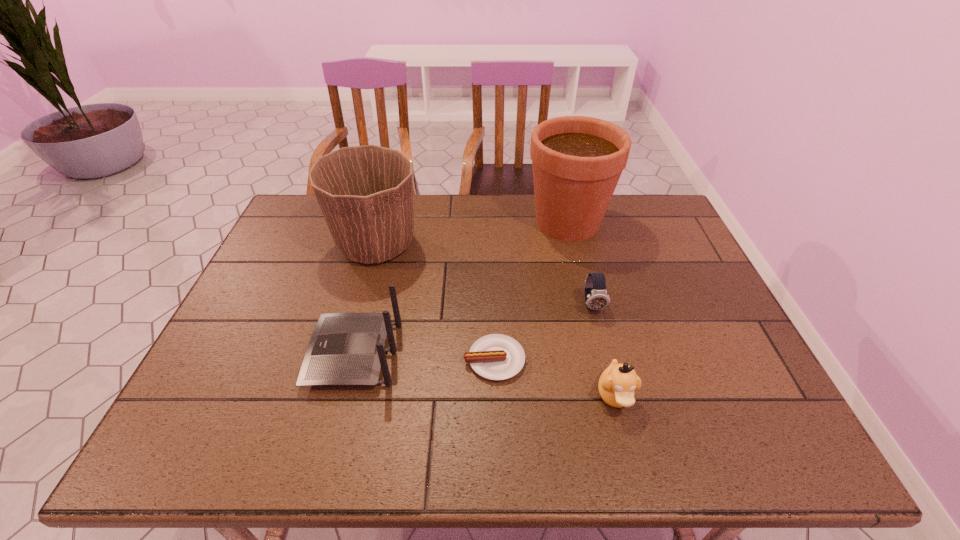
The width and height of the screenshot is (960, 540). In order to click on the right flowerpot in this screenshot , I will do `click(577, 161)`.

The height and width of the screenshot is (540, 960). I want to click on the left flowerpot, so click(x=364, y=192).

At what (x,y) coordinates should I click in order to perform the action: click on the third tallest object. Please return your answer as a coordinate pair (x, y). Looking at the image, I should click on (345, 348).

Find the location of a particular element. duckling is located at coordinates (617, 384).

Find the location of a particular element. The width and height of the screenshot is (960, 540). watch is located at coordinates (596, 297).

Find the location of a particular element. This screenshot has width=960, height=540. sausage is located at coordinates (496, 357).

Find the location of a particular element. The width and height of the screenshot is (960, 540). the fourth object from right to left is located at coordinates (496, 357).

You are a GUI agent. You are given a task and a screenshot of the screen. Output one action in this format:
    pyautogui.click(x=<x>, y=<y>)
    Task: Click on the free space located 0.260m on the left of the right flowerpot
    The width and height of the screenshot is (960, 540).
    Given the screenshot: What is the action you would take?
    pyautogui.click(x=446, y=222)

At what (x,y) coordinates should I click in order to perform the action: click on free space located 0.160m on the left of the left flowerpot. Please return your answer as a coordinate pair (x, y). The image size is (960, 540). Looking at the image, I should click on (280, 245).

In order to click on vacant position located 0.240m on the front-facing side of the router in this screenshot , I will do `click(213, 354)`.